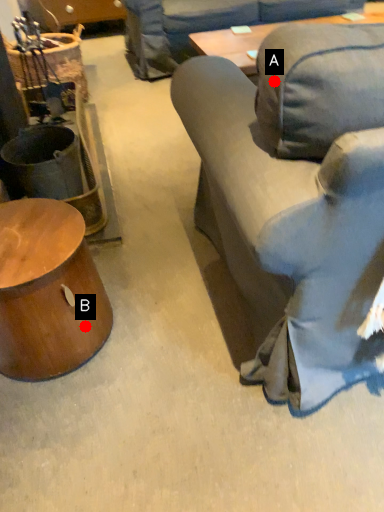
Question: Two points are circled on the image, labeled by A and B beside each circle. Which point is farther from the camera taking this photo?

Choices:
 (A) A is further
 (B) B is further

Answer: (B)